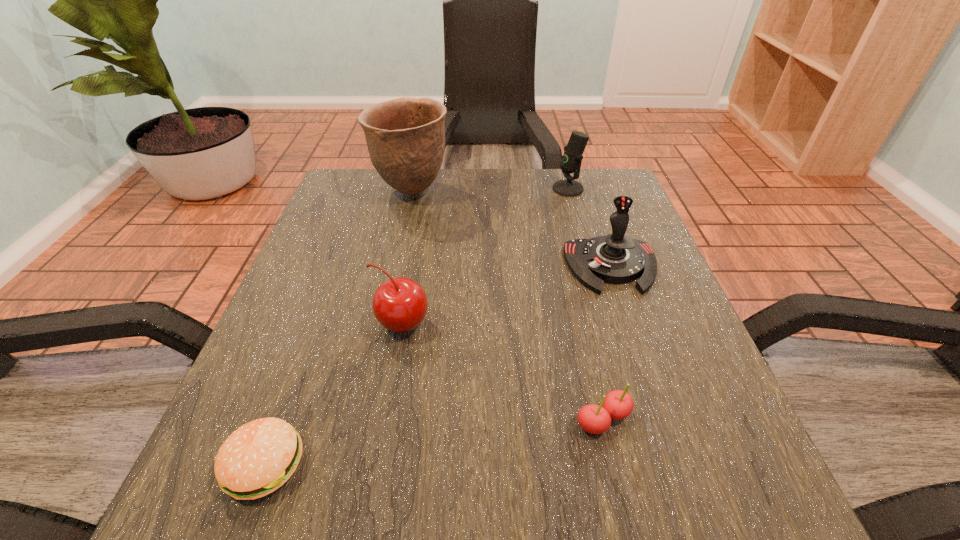
Where is `object that is the fifth closest one to the shortest object`? This screenshot has height=540, width=960. object that is the fifth closest one to the shortest object is located at coordinates (571, 160).

This screenshot has width=960, height=540. I want to click on object that is the fifth closest one to the microphone, so click(x=259, y=457).

Locate an element on the screen. vacant space that satisfies the following two spatial constraints: 1. on the back side of the microphone; 2. on the right side of the third shortest object is located at coordinates pos(425,188).

This screenshot has width=960, height=540. Find the location of `vacant space that satisfies the following two spatial constraints: 1. on the back side of the microphone; 2. on the left side of the taller cherry`. vacant space that satisfies the following two spatial constraints: 1. on the back side of the microphone; 2. on the left side of the taller cherry is located at coordinates (425, 188).

Identify the location of free space that satisfies the following two spatial constraints: 1. on the back side of the patty; 2. on the right side of the second shortest object. (281, 420).